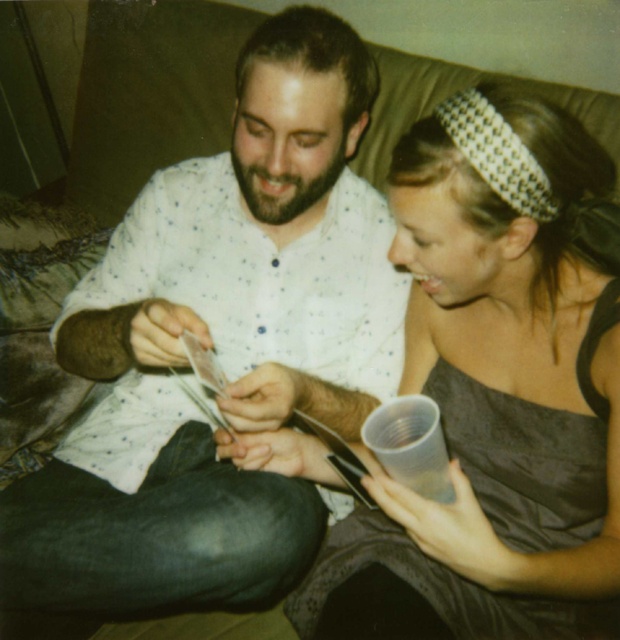
Describe the element at coordinates (219, 349) in the screenshot. I see `white dotted shirt at center` at that location.

Image resolution: width=620 pixels, height=640 pixels. I want to click on white dotted shirt at center, so click(x=219, y=349).